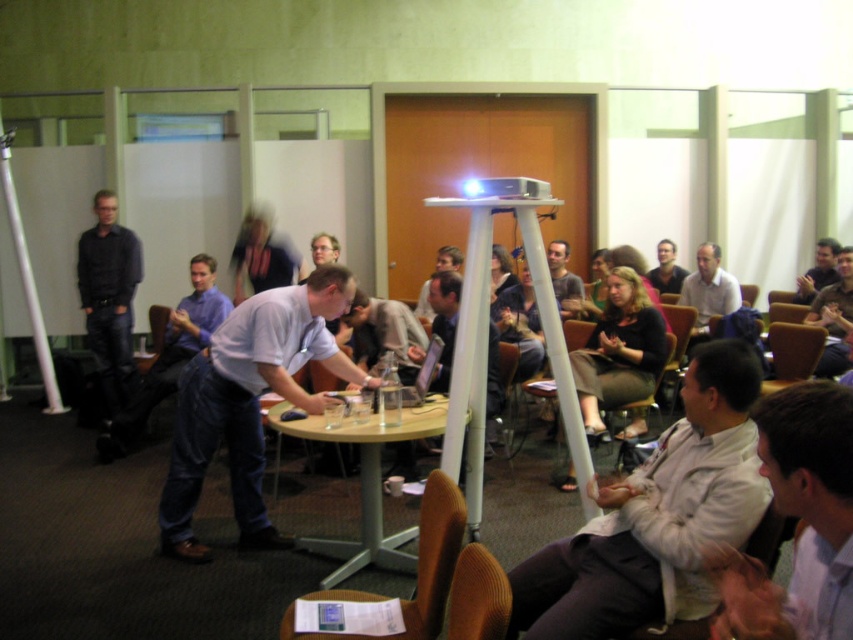
Question: Among these objects, which one is nearest to the camera?

Choices:
 (A) light brown leather jacket at lower right
 (B) brown leather chair at lower center
 (C) matte black shirt at left
 (D) dark gray shirt at center

Answer: (B)

Question: Can you confirm if brown leather chair at lower center is thinner than dark gray shirt at center?

Choices:
 (A) yes
 (B) no

Answer: (B)

Question: Is brown leather chair at lower center positioned in front of light brown hair at center?

Choices:
 (A) yes
 (B) no

Answer: (A)

Question: Does brown leather chair at lower center appear on the right side of wooden chair at lower right?

Choices:
 (A) no
 (B) yes

Answer: (A)

Question: Among these points, which one is nearest to the camera?

Choices:
 (A) (425, 545)
 (B) (788, 336)

Answer: (A)

Question: Which object appears farthest from the camera in this image?

Choices:
 (A) light brown hair at center
 (B) light gray shirt at center
 (C) blue shirt at center

Answer: (B)